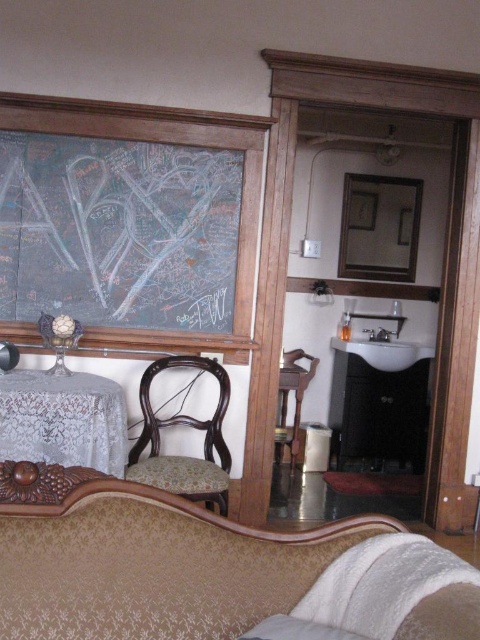
Where is the velvet gold couch at lower center located in the coordinate system?

The velvet gold couch at lower center is located at point (210,570).

You are planning to place a large rectangular box that is 2 meters in length between the velvet gold couch at lower center and the lace fabric table at lower left. Considering the space between them, will the box fit horizontally?

The velvet gold couch at lower center is wider than the lace fabric table at lower left. However, the exact distance between them isn t specified in the provided information, so we can t determine if the 2 meter box will fit horizontally.